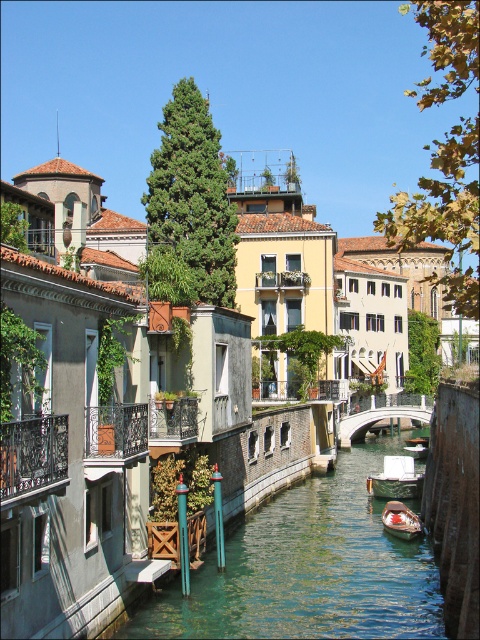
You are a tourist in the historic city and want to cross the canal. The white stone bridge at center is your only option. Can you reach the bridge from your current position at point 0.5, 0.5?

The white stone bridge at center is located at point (382, 413). Since your current position is at (240, 320), you can move towards the bridge and reach it by navigating along the canal towards the bridge.

You are standing on the left side of the canal and want to cross to the right side. There is a white stone bridge at center and greenish water at center. Which object should you use to cross the canal?

You should use the white stone bridge at center to cross the canal because the greenish water at center is located to the left of the bridge and cannot be used for crossing.

You are standing at point (409,484) and want to cross the canal to the other side. The bridge is 74.53 meters away from you. Is the bridge far enough to walk to?

The bridge is 74.53 meters away from point (409,484), so yes, it is far enough to walk to.